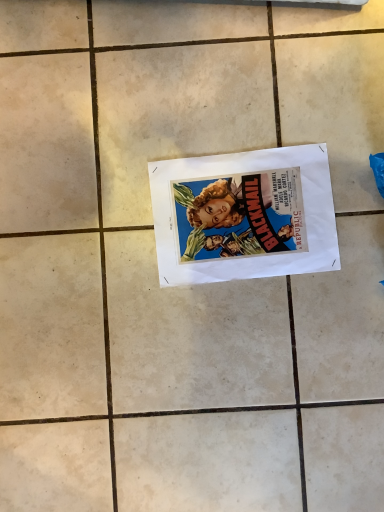
Identify the location of free spot above matte paper poster at center (from a real-world perspective). This screenshot has height=512, width=384. (249, 211).